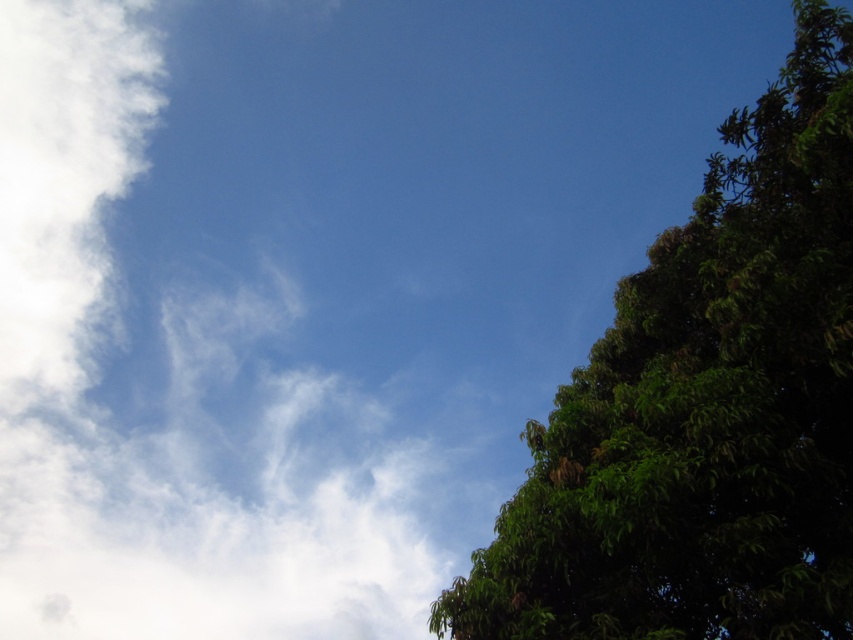
Question: Which point is closer to the camera?

Choices:
 (A) (675, 426)
 (B) (100, 54)

Answer: (A)

Question: Which point is closer to the camera?

Choices:
 (A) white fluffy cloud at upper left
 (B) green leafy tree at right

Answer: (B)

Question: Is white fluffy cloud at upper left to the right of green leafy tree at right from the viewer's perspective?

Choices:
 (A) yes
 (B) no

Answer: (B)

Question: Can you confirm if white fluffy cloud at upper left is positioned above green leafy tree at right?

Choices:
 (A) yes
 (B) no

Answer: (A)

Question: Observing the image, what is the correct spatial positioning of white fluffy cloud at upper left in reference to green leafy tree at right?

Choices:
 (A) right
 (B) left

Answer: (B)